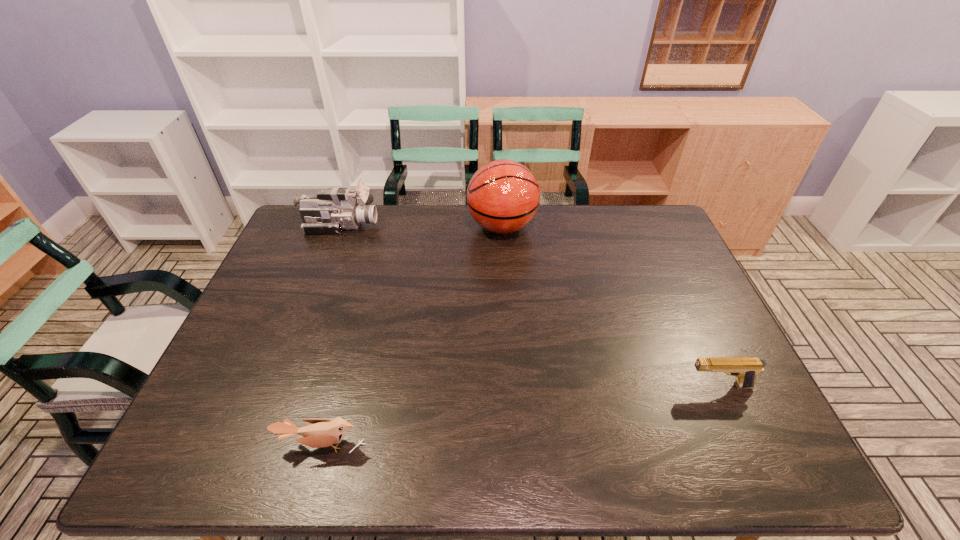
You are a GUI agent. You are given a task and a screenshot of the screen. Output one action in this format:
    pyautogui.click(x=<x>, y=<y>)
    Task: Click on the blank region between the third farthest object and the bird
    The image size is (960, 540).
    Given the screenshot: What is the action you would take?
    pyautogui.click(x=520, y=415)

The image size is (960, 540). Identify the location of free space between the third farthest object and the camcorder. (530, 306).

You are a GUI agent. You are given a task and a screenshot of the screen. Output one action in this format:
    pyautogui.click(x=<x>, y=<y>)
    Task: Click on the object that is the second closest one to the tallest object
    The height and width of the screenshot is (540, 960).
    Given the screenshot: What is the action you would take?
    pyautogui.click(x=745, y=369)

At what (x,y) coordinates should I click in order to perform the action: click on the second closest object to the second object from right to left. Please return your answer as a coordinate pair (x, y). The image size is (960, 540). Looking at the image, I should click on (745, 369).

Identify the location of vacant space that satisfies the following two spatial constraints: 1. at the barrel of the third farthest object; 2. at the beak of the bird. This screenshot has width=960, height=540. (745, 444).

You are a GUI agent. You are given a task and a screenshot of the screen. Output one action in this format:
    pyautogui.click(x=<x>, y=<y>)
    Task: Click on the vacant region that satisfies the following two spatial constraints: 1. on the side with spill of the basketball; 2. at the beak of the nearest object
    This screenshot has height=540, width=960.
    Given the screenshot: What is the action you would take?
    pyautogui.click(x=516, y=444)